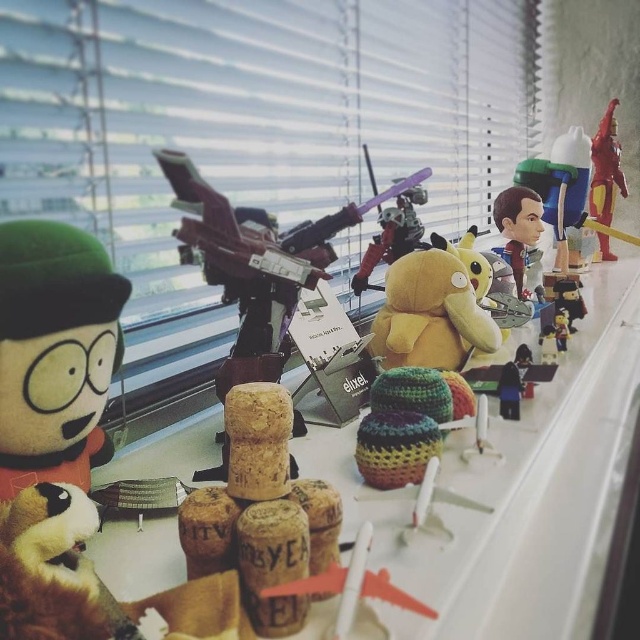
You are organizing the toys on the windowsill and need to place a new toy exactly at the center of the windowsill. However, there is already a smooth plastic toy at center. Where should you place the new toy to avoid overlapping with the existing one?

The smooth plastic toy at center is located at point (561,186), so you should place the new toy elsewhere on the windowsill to avoid overlapping with it.

You are a toy collector examining the windowsill arrangement. You notice a specific point at coordinates (x=54, y=352). What object is located exactly at that point?

The fluffy green plush at left is located exactly at point (x=54, y=352).

You are a delivery robot with a 30 inch wide package. You need to place it between the cork at center and the brown cork stoppers at center. Is there enough space?

The distance between the cork at center and the brown cork stoppers at center is 27.97 inches. Since the package is 30 inches wide, it won not fit as the space is narrower than the package.